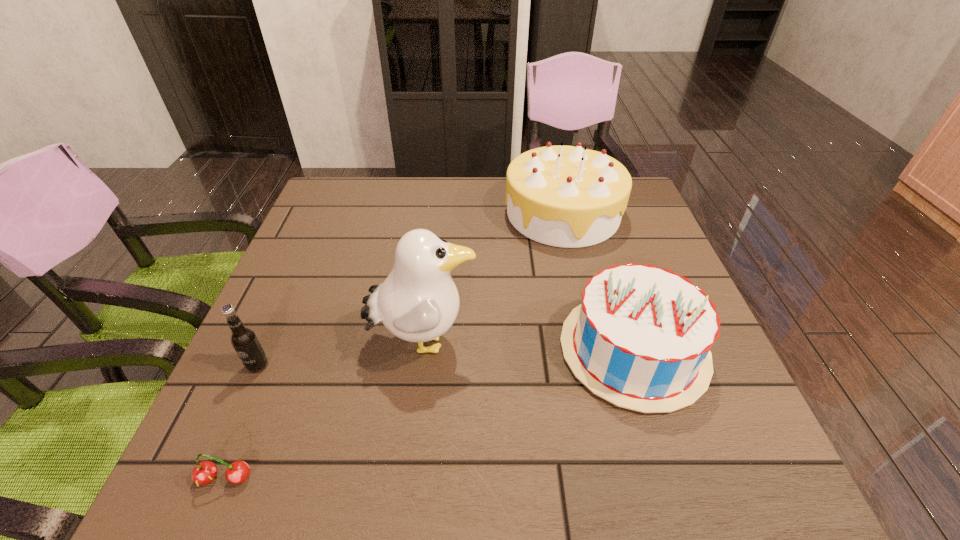
Where is `gull`? The width and height of the screenshot is (960, 540). gull is located at coordinates (418, 301).

This screenshot has width=960, height=540. I want to click on the third object from left to right, so click(x=418, y=301).

Locate an element on the screen. The width and height of the screenshot is (960, 540). the farther birthday cake is located at coordinates (564, 196).

Locate an element on the screen. Image resolution: width=960 pixels, height=540 pixels. the nearer birthday cake is located at coordinates (641, 338).

Locate an element on the screen. The width and height of the screenshot is (960, 540). root beer is located at coordinates (243, 339).

You are a GUI agent. You are given a task and a screenshot of the screen. Output one action in this format:
    pyautogui.click(x=<x>, y=<y>)
    Task: Click on the cherry
    The height and width of the screenshot is (540, 960).
    Given the screenshot: What is the action you would take?
    pyautogui.click(x=204, y=473)

Identify the location of the nearest object. (204, 473).

Locate an element on the screen. Image resolution: width=960 pixels, height=540 pixels. vacant point located on the beak of the third object from left to right is located at coordinates (540, 342).

This screenshot has width=960, height=540. Find the location of `vacant area situated on the left of the farthest object`. vacant area situated on the left of the farthest object is located at coordinates (427, 214).

I want to click on vacant region located 0.130m on the back of the shorter birthday cake, so click(605, 261).